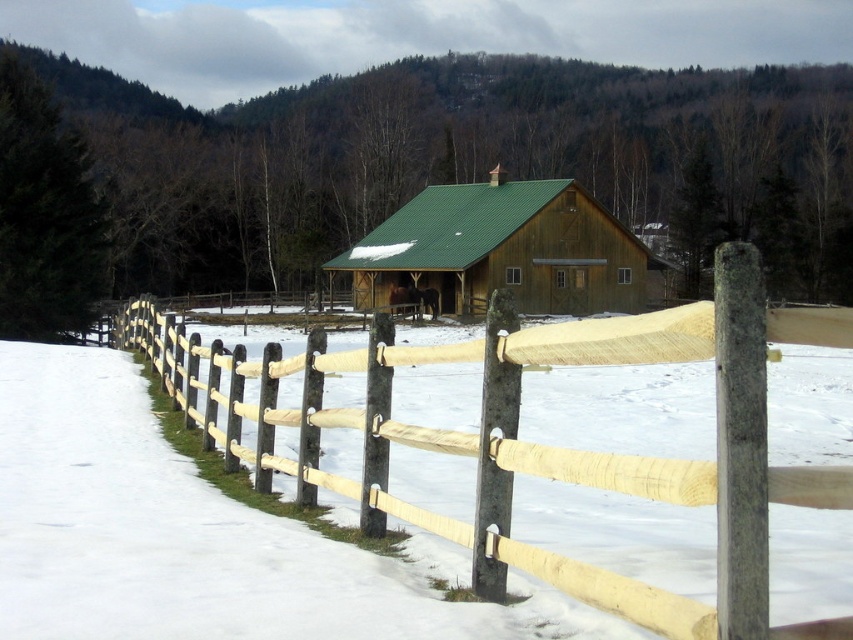
Question: Based on their relative distances, which object is farther from the gray wood post at center?

Choices:
 (A) wooden split rail fence at center
 (B) green wooden barn at center

Answer: (B)

Question: Where is wooden split rail fence at center located in relation to gray wood post at center in the image?

Choices:
 (A) above
 (B) below

Answer: (A)

Question: Is green wooden barn at center bigger than gray wood post at center?

Choices:
 (A) yes
 (B) no

Answer: (A)

Question: Which point appears farthest from the camera in this image?

Choices:
 (A) click(x=601, y=225)
 (B) click(x=761, y=355)
 (C) click(x=763, y=360)

Answer: (A)

Question: Is green wooden barn at center to the left of gray wood post at center from the viewer's perspective?

Choices:
 (A) yes
 (B) no

Answer: (B)

Question: Which of these objects is positioned closest to the gray wood post at center?

Choices:
 (A) green wooden barn at center
 (B) wooden split rail fence at center

Answer: (B)